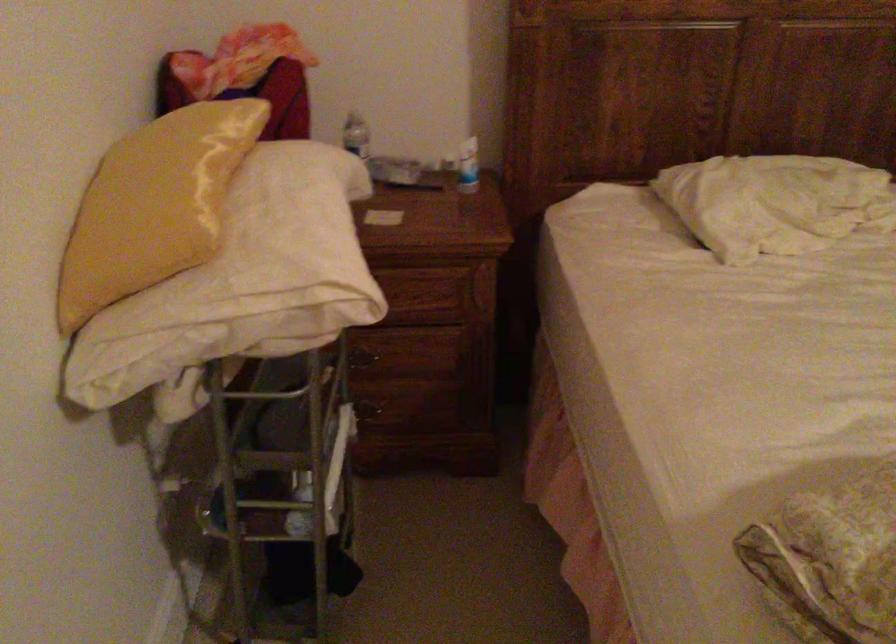
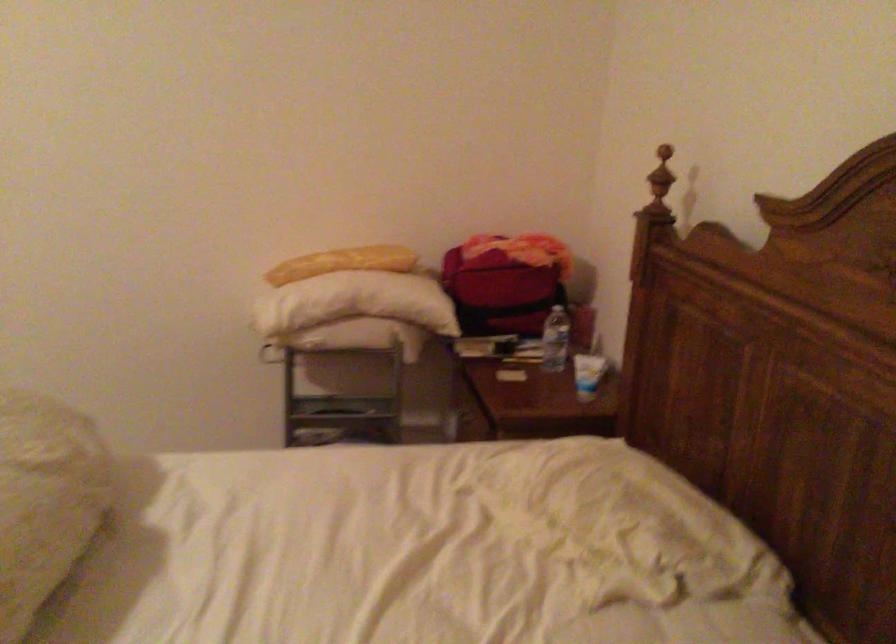
In the second image, find the point that corresponds to [211,171] in the first image.

(342, 263)